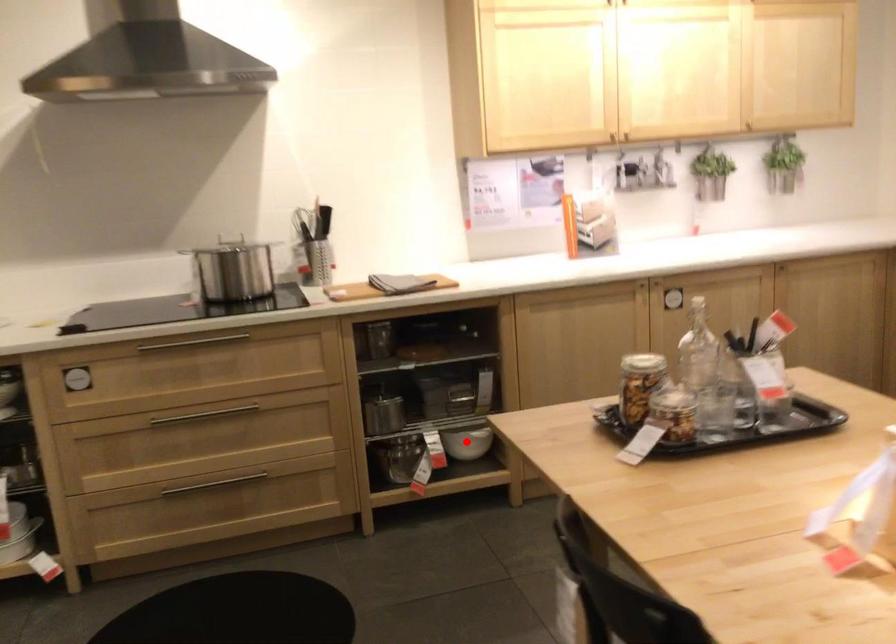
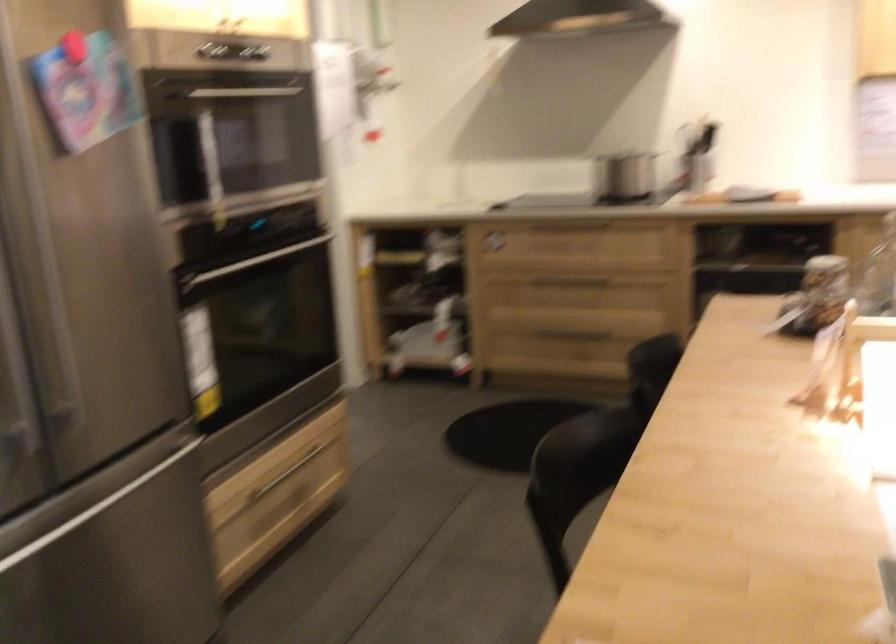
Question: I am providing you with two images of the same scene from different viewpoints. A red point is marked on the first image. Is the red point's position out of view in image 2?

Choices:
 (A) Yes
 (B) No

Answer: (A)